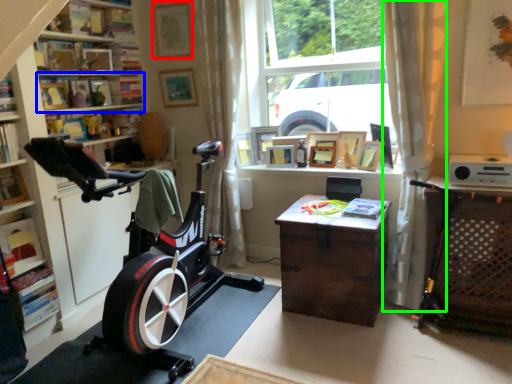
Question: Considering the real-world distances, which object is closest to picture frame (highlighted by a red box)? shelf (highlighted by a blue box) or curtain (highlighted by a green box).

Choices:
 (A) shelf
 (B) curtain

Answer: (A)